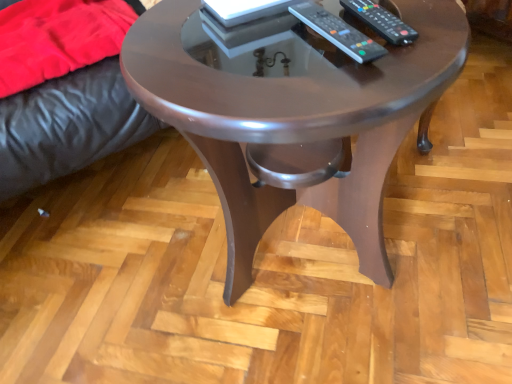
Find the location of a particular element. vacant space to the right of black plastic remote at center, the first remote in the left-to-right sequence is located at coordinates (418, 28).